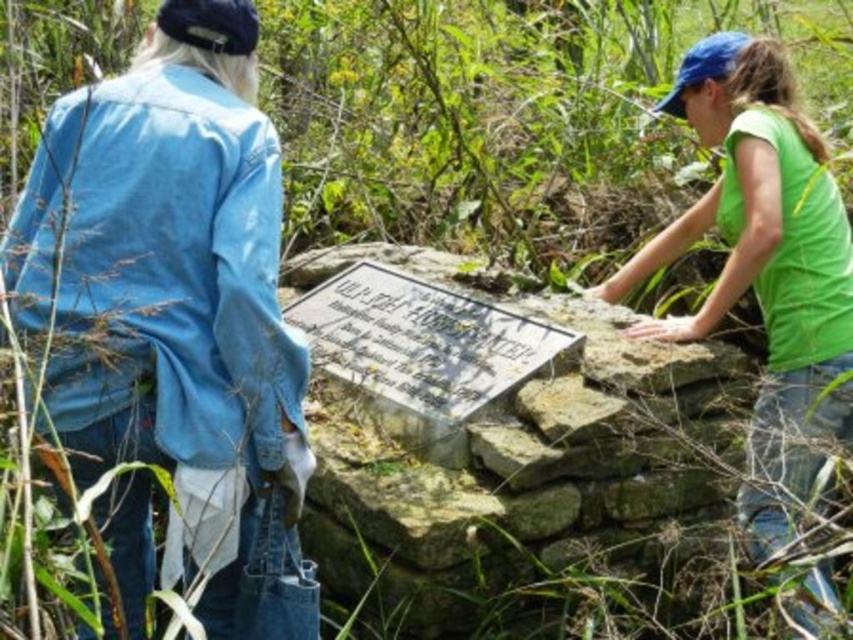
Question: Does green matte shirt at upper right have a larger size compared to metallic silver plaque at center?

Choices:
 (A) no
 (B) yes

Answer: (B)

Question: Can you confirm if denim jacket at upper left is positioned above green matte shirt at upper right?

Choices:
 (A) yes
 (B) no

Answer: (A)

Question: Estimate the real-world distances between objects in this image. Which object is farther from the denim jacket at upper left?

Choices:
 (A) metallic silver plaque at center
 (B) green matte shirt at upper right

Answer: (B)

Question: Is green matte shirt at upper right below metallic silver plaque at center?

Choices:
 (A) no
 (B) yes

Answer: (A)

Question: Which object is positioned farthest from the metallic silver plaque at center?

Choices:
 (A) green matte shirt at upper right
 (B) denim jacket at upper left

Answer: (B)

Question: Which object is farther from the camera taking this photo?

Choices:
 (A) denim jacket at upper left
 (B) metallic silver plaque at center
 (C) green matte shirt at upper right

Answer: (B)